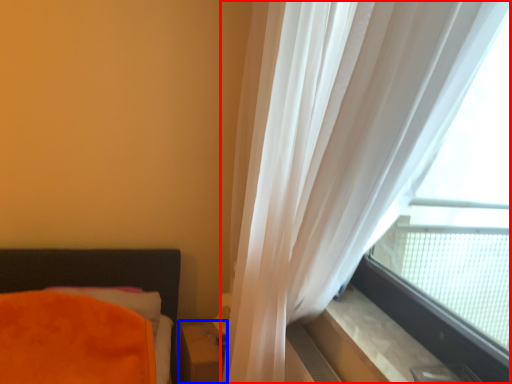
Question: Which of the following is the closest to the observer, curtain (highlighted by a red box) or table (highlighted by a blue box)?

Choices:
 (A) curtain
 (B) table

Answer: (A)